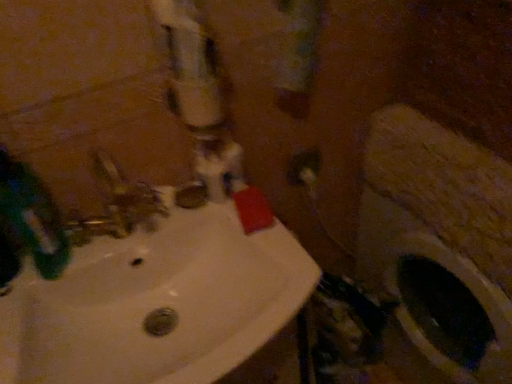
Question: Is white glossy water pipe at upper center behind green matte toothbrush at left?

Choices:
 (A) yes
 (B) no

Answer: (B)

Question: Can you confirm if white glossy water pipe at upper center is smaller than green matte toothbrush at left?

Choices:
 (A) yes
 (B) no

Answer: (B)

Question: Is white glossy water pipe at upper center touching green matte toothbrush at left?

Choices:
 (A) yes
 (B) no

Answer: (B)

Question: From a real-world perspective, is white glossy water pipe at upper center on green matte toothbrush at left?

Choices:
 (A) yes
 (B) no

Answer: (A)

Question: Is green matte toothbrush at left a part of white glossy water pipe at upper center?

Choices:
 (A) no
 (B) yes

Answer: (A)

Question: Considering their positions, is white glossy water pipe at upper center located in front of or behind green matte toothbrush at left?

Choices:
 (A) behind
 (B) front

Answer: (B)

Question: Choose the correct answer: Is white glossy water pipe at upper center inside green matte toothbrush at left or outside it?

Choices:
 (A) outside
 (B) inside

Answer: (A)

Question: From the image's perspective, is white glossy water pipe at upper center above or below green matte toothbrush at left?

Choices:
 (A) below
 (B) above

Answer: (B)

Question: Considering the positions of white glossy water pipe at upper center and green matte toothbrush at left in the image, is white glossy water pipe at upper center bigger or smaller than green matte toothbrush at left?

Choices:
 (A) small
 (B) big

Answer: (B)

Question: Relative to white glossy sink at center, is matte white outlet at center in front or behind?

Choices:
 (A) front
 (B) behind

Answer: (B)

Question: Looking at their shapes, would you say matte white outlet at center is wider or thinner than white glossy sink at center?

Choices:
 (A) wide
 (B) thin

Answer: (B)

Question: Considering the positions of point (301, 185) and point (210, 107), is point (301, 185) closer or farther from the camera than point (210, 107)?

Choices:
 (A) closer
 (B) farther

Answer: (B)

Question: From the image's perspective, is matte white outlet at center above or below white glossy sink at center?

Choices:
 (A) below
 (B) above

Answer: (B)

Question: Relative to white glossy sink at center, is white glossy water pipe at upper center in front or behind?

Choices:
 (A) front
 (B) behind

Answer: (B)

Question: Is white glossy water pipe at upper center wider or thinner than white glossy sink at center?

Choices:
 (A) thin
 (B) wide

Answer: (A)